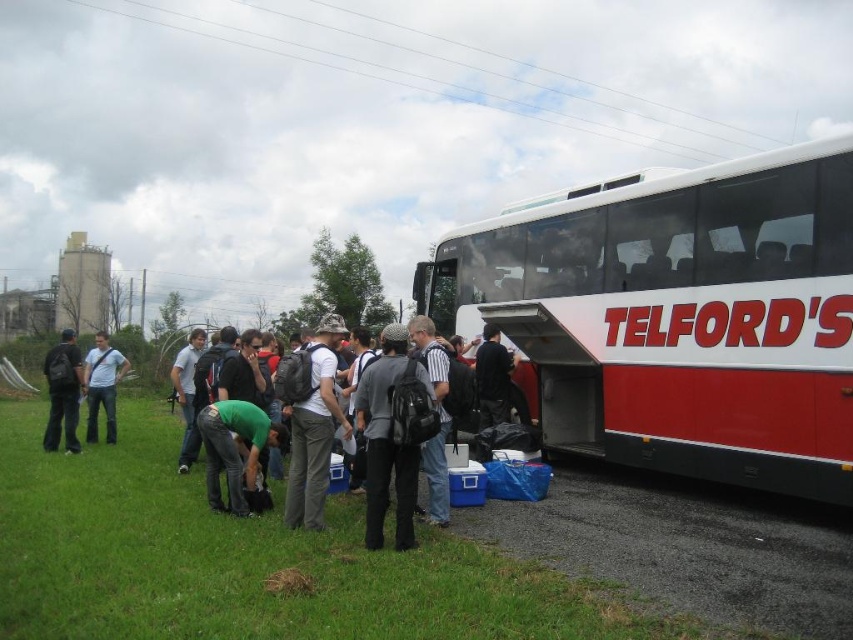
Question: Observing the image, what is the correct spatial positioning of green matte shirt at lower left in reference to matte black backpack at left?

Choices:
 (A) above
 (B) below

Answer: (A)

Question: Which point appears closest to the camera in this image?

Choices:
 (A) (728, 362)
 (B) (103, 381)

Answer: (A)

Question: Among these points, which one is nearest to the camera?

Choices:
 (A) (503, 372)
 (B) (90, 410)

Answer: (A)

Question: Does matte black backpack at left have a smaller size compared to matte white shirt at center?

Choices:
 (A) no
 (B) yes

Answer: (B)

Question: Can you confirm if red matte bus at right is positioned to the left of dark gray fabric backpack at center?

Choices:
 (A) no
 (B) yes

Answer: (A)

Question: Which of the following is the closest to the observer?

Choices:
 (A) (749, 483)
 (B) (170, 372)
 (C) (314, 406)

Answer: (C)